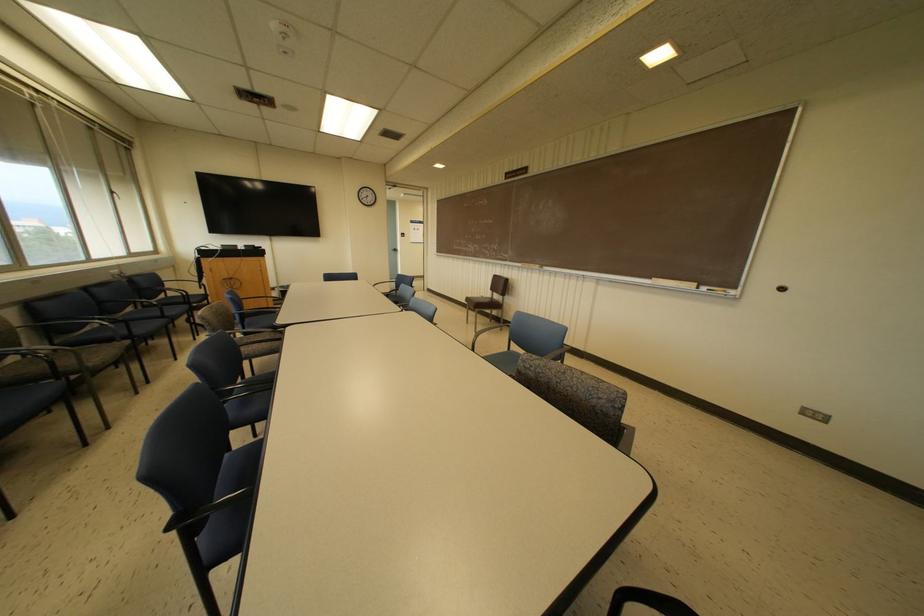
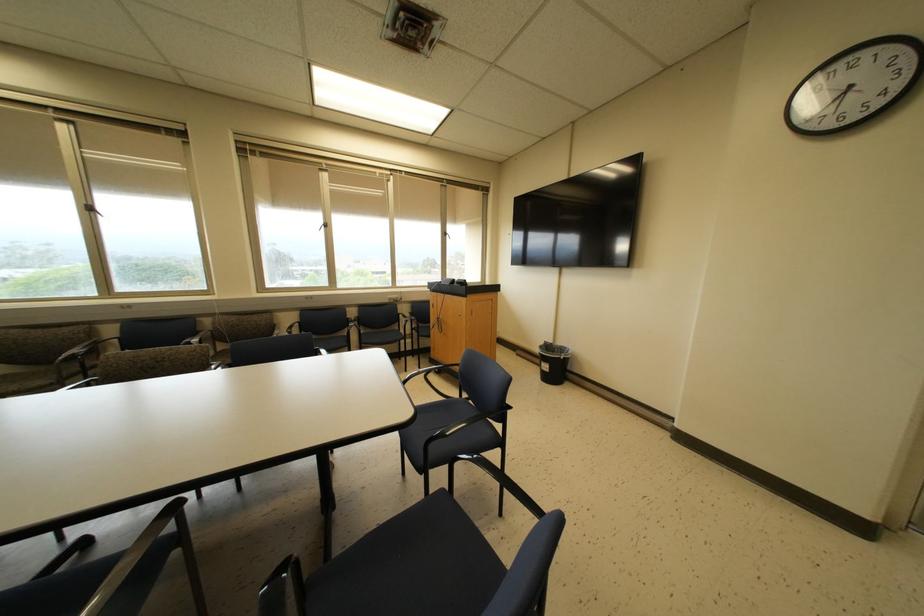
In the second image, find the point that corresponds to (x=112, y=192) in the first image.

(444, 233)